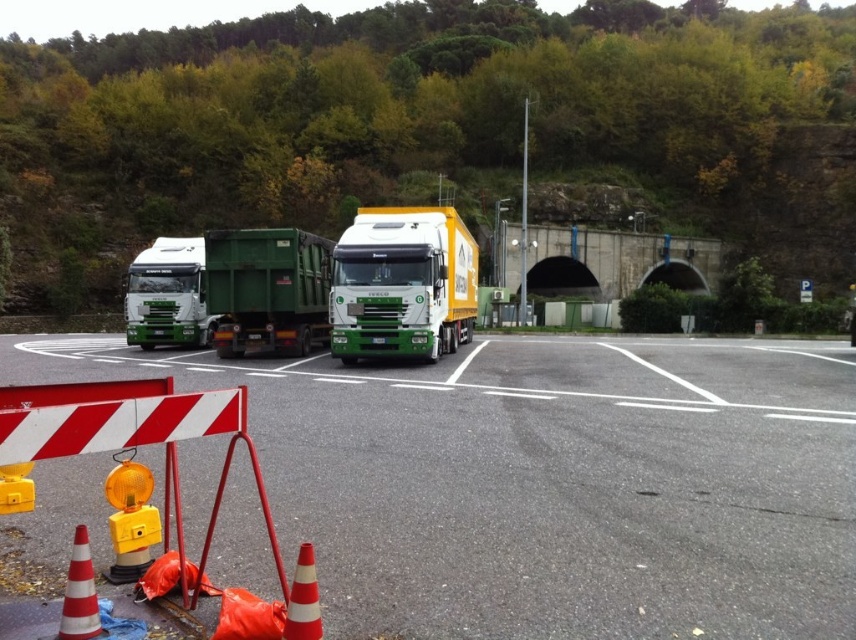
Question: Is gray asphalt parking lot at center further to the viewer compared to green matte trailer truck at center?

Choices:
 (A) no
 (B) yes

Answer: (A)

Question: Which point appears closest to the camera in this image?

Choices:
 (A) (428, 301)
 (B) (84, 552)
 (C) (715, 266)

Answer: (B)

Question: Can you confirm if gray asphalt parking lot at center is positioned above concrete tunnel at center?

Choices:
 (A) no
 (B) yes

Answer: (A)

Question: Estimate the real-world distances between objects in this image. Which object is farther from the green matte trailer truck at center?

Choices:
 (A) gray asphalt parking lot at center
 (B) green matte truck at center
 (C) green matte truck at left

Answer: (A)

Question: Among these points, which one is nearest to the camera?

Choices:
 (A) click(x=406, y=208)
 (B) click(x=568, y=260)
 (C) click(x=676, y=444)
 (D) click(x=289, y=259)

Answer: (C)

Question: Is green matte truck at center wider than orange reflective cone at lower left?

Choices:
 (A) yes
 (B) no

Answer: (A)